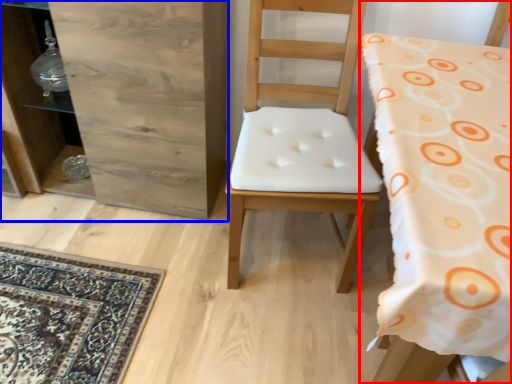
Question: Which object is closer to the camera taking this photo, chair (highlighted by a red box) or dresser (highlighted by a blue box)?

Choices:
 (A) chair
 (B) dresser

Answer: (A)